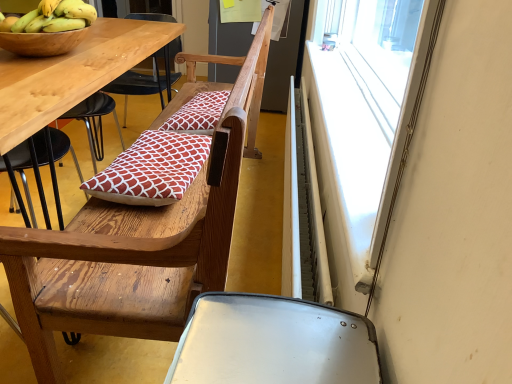
Question: From a real-world perspective, is wooden chair at center physically below red printed cushion at center, the 1th pillow in the front-to-back sequence?

Choices:
 (A) no
 (B) yes

Answer: (B)

Question: Is wooden chair at center not within red printed cushion at center, which appears as the 2th pillow when viewed from the back?

Choices:
 (A) yes
 (B) no

Answer: (A)

Question: Does wooden chair at center appear on the left side of red printed cushion at center, the 2th pillow when ordered from top to bottom?

Choices:
 (A) yes
 (B) no

Answer: (B)

Question: Is wooden chair at center facing away from red printed cushion at center, the 2th pillow when ordered from top to bottom?

Choices:
 (A) yes
 (B) no

Answer: (A)

Question: Can you confirm if wooden chair at center is smaller than red printed cushion at center, positioned as the first pillow in bottom-to-top order?

Choices:
 (A) no
 (B) yes

Answer: (A)

Question: Is point (183, 137) closer or farther from the camera than point (156, 309)?

Choices:
 (A) closer
 (B) farther

Answer: (B)

Question: Is red printed cushion at center, which appears as the 2th pillow when viewed from the back, in front of or behind wooden chair at center in the image?

Choices:
 (A) front
 (B) behind

Answer: (B)

Question: Considering the positions of red printed cushion at center, the 2th pillow when ordered from top to bottom, and wooden chair at center in the image, is red printed cushion at center, the 2th pillow when ordered from top to bottom, wider or thinner than wooden chair at center?

Choices:
 (A) wide
 (B) thin

Answer: (B)

Question: Based on their sizes in the image, would you say red printed cushion at center, the 1th pillow in the front-to-back sequence, is bigger or smaller than wooden chair at center?

Choices:
 (A) small
 (B) big

Answer: (A)

Question: From the image's perspective, is yellow matte bananas at upper left located above or below wooden chair at center?

Choices:
 (A) above
 (B) below

Answer: (A)

Question: Considering the positions of yellow matte bananas at upper left and wooden chair at center in the image, is yellow matte bananas at upper left wider or thinner than wooden chair at center?

Choices:
 (A) wide
 (B) thin

Answer: (B)

Question: Is yellow matte bananas at upper left taller or shorter than wooden chair at center?

Choices:
 (A) short
 (B) tall

Answer: (A)

Question: From a real-world perspective, is yellow matte bananas at upper left physically located above or below wooden chair at center?

Choices:
 (A) above
 (B) below

Answer: (A)

Question: In terms of size, does yellow matte bananas at upper left appear bigger or smaller than red printed cushion at center, which is counted as the second pillow, starting from the front?

Choices:
 (A) big
 (B) small

Answer: (B)

Question: In the image, is yellow matte bananas at upper left on the left side or the right side of red printed cushion at center, which is the first pillow in back-to-front order?

Choices:
 (A) left
 (B) right

Answer: (A)